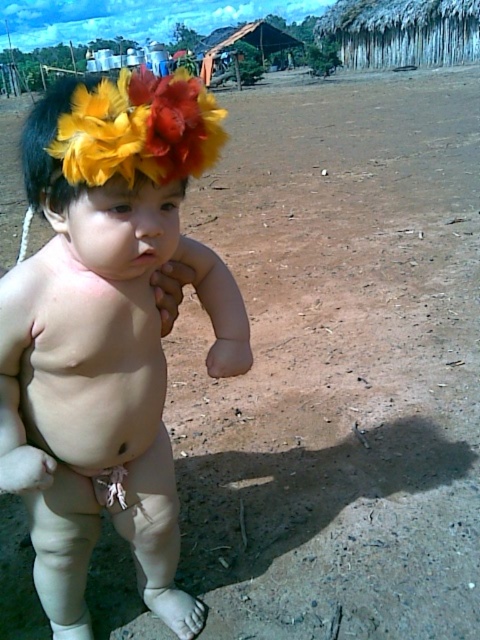
Question: Can you confirm if fluffy fabric flower at center is bigger than pink smooth skin at center?

Choices:
 (A) yes
 (B) no

Answer: (A)

Question: Which object appears farthest from the camera in this image?

Choices:
 (A) white cloth diaper at lower center
 (B) fluffy fabric flower at center
 (C) pink smooth skin at center
 (D) feathered headband at upper center

Answer: (A)

Question: Does pink smooth skin at center have a larger size compared to feathered headband at upper center?

Choices:
 (A) no
 (B) yes

Answer: (A)

Question: Does fluffy fabric flower at center have a lesser width compared to white cloth diaper at lower center?

Choices:
 (A) yes
 (B) no

Answer: (B)

Question: Which object is farther from the camera taking this photo?

Choices:
 (A) fluffy fabric flower at center
 (B) pink smooth skin at center
 (C) white cloth diaper at lower center

Answer: (C)

Question: Among these objects, which one is farthest from the camera?

Choices:
 (A) feathered headband at upper center
 (B) pink smooth skin at center

Answer: (B)